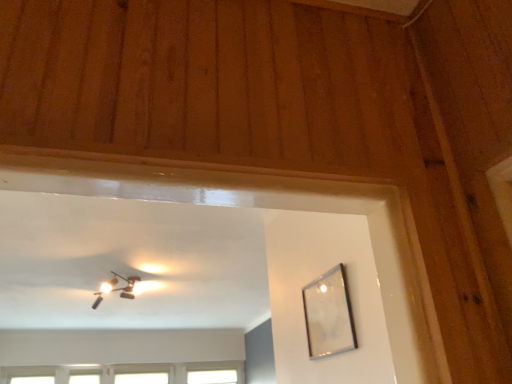
Find the location of a particular element. Image resolution: width=512 pixels, height=384 pixels. clear glass picture frame at upper right is located at coordinates (329, 314).

What do you see at coordinates (212, 377) in the screenshot? I see `white glass window at upper center, which ranks as the fourth window in left-to-right order` at bounding box center [212, 377].

Locate an element on the screen. The height and width of the screenshot is (384, 512). white glass window at upper center, which ranks as the fourth window in left-to-right order is located at coordinates (212, 377).

This screenshot has width=512, height=384. What do you see at coordinates (85, 376) in the screenshot?
I see `transparent glass window at lower left, the 2th window when ordered from left to right` at bounding box center [85, 376].

In order to face clear glass window at lower center, acting as the 3th window starting from the left, should I rotate leftwards or rightwards?

A 14.907 degree turn to the left will do.

At what (x,y) coordinates should I click in order to perform the action: click on clear glass picture frame at upper right. Please return your answer as a coordinate pair (x, y). This screenshot has width=512, height=384. Looking at the image, I should click on (329, 314).

Which is more to the right, matte black fixture at upper center or clear glass window at lower center, acting as the 3th window starting from the left?

From the viewer's perspective, matte black fixture at upper center appears more on the right side.

From the picture: Which point is more distant from viewer, (110,284) or (152,379)?

Point (152,379)

Between matte black fixture at upper center and clear glass window at lower center, acting as the 3th window starting from the left, which one has larger width?

Wider between the two is matte black fixture at upper center.

Which object is further away from the camera taking this photo, matte black fixture at upper center or clear glass window at lower center, acting as the 3th window starting from the left?

clear glass window at lower center, acting as the 3th window starting from the left, is further from the camera.

Is clear glass window at lower center, acting as the 3th window starting from the left, aimed at transparent glass window at lower left, acting as the first window starting from the left?

No.

What's the angular difference between clear glass window at lower center, the second window from the right, and transparent glass window at lower left, acting as the first window starting from the left,'s facing directions?

They differ by 0.0021 degrees in their facing directions.

Between clear glass window at lower center, acting as the 3th window starting from the left, and transparent glass window at lower left, acting as the first window starting from the left, which one has smaller size?

transparent glass window at lower left, acting as the first window starting from the left, is smaller.

Which is behind, point (121, 380) or point (39, 375)?

Point (121, 380)

Can you tell me how much matte black fixture at upper center and transparent glass window at lower left, acting as the first window starting from the left, differ in facing direction?

The angle between the facing direction of matte black fixture at upper center and the facing direction of transparent glass window at lower left, acting as the first window starting from the left, is 1.71 degrees.

From their relative heights in the image, would you say matte black fixture at upper center is taller or shorter than transparent glass window at lower left, acting as the first window starting from the left?

In the image, matte black fixture at upper center appears to be taller than transparent glass window at lower left, acting as the first window starting from the left.

Would you say matte black fixture at upper center contains transparent glass window at lower left, acting as the first window starting from the left?

No.

From a real-world perspective, is matte black fixture at upper center located beneath transparent glass window at lower left, acting as the first window starting from the left?

A: No, from a real-world perspective, matte black fixture at upper center is not below transparent glass window at lower left, acting as the first window starting from the left.

At what (x,y) coordinates should I click in order to perform the action: click on picture frame lying in front of the matte black fixture at upper center. Please return your answer as a coordinate pair (x, y). The image size is (512, 384). Looking at the image, I should click on (329, 314).

How far apart are clear glass picture frame at upper right and matte black fixture at upper center?

clear glass picture frame at upper right is 2.08 meters from matte black fixture at upper center.

From the image's perspective, is clear glass picture frame at upper right under matte black fixture at upper center?

No.

Can you see clear glass picture frame at upper right touching matte black fixture at upper center?

No, clear glass picture frame at upper right is not making contact with matte black fixture at upper center.

Between matte black fixture at upper center and transparent glass window at lower left, the 3th window when ordered from right to left, which one appears on the right side from the viewer's perspective?

Positioned to the right is matte black fixture at upper center.

Could you measure the distance between matte black fixture at upper center and transparent glass window at lower left, the 2th window when ordered from left to right?

matte black fixture at upper center is 7.02 feet from transparent glass window at lower left, the 2th window when ordered from left to right.

Is point (124, 293) in front of point (86, 372)?

Yes, it is.

Is matte black fixture at upper center inside the boundaries of transparent glass window at lower left, the 3th window when ordered from right to left, or outside?

matte black fixture at upper center is spatially situated outside transparent glass window at lower left, the 3th window when ordered from right to left.

At what (x,y) coordinates should I click in order to perform the action: click on lamp on the right of clear glass window at lower center, acting as the 3th window starting from the left. Please return your answer as a coordinate pair (x, y). The image size is (512, 384). Looking at the image, I should click on (116, 288).

Which of these two, clear glass window at lower center, acting as the 3th window starting from the left, or matte black fixture at upper center, stands taller?

Standing taller between the two is clear glass window at lower center, acting as the 3th window starting from the left.

Is point (146, 376) closer to camera compared to point (112, 291)?

That is False.

Does clear glass picture frame at upper right have a smaller size compared to transparent glass window at lower left, the 2th window when ordered from left to right?

Indeed, clear glass picture frame at upper right has a smaller size compared to transparent glass window at lower left, the 2th window when ordered from left to right.

Is clear glass picture frame at upper right beside transparent glass window at lower left, the 2th window when ordered from left to right?

clear glass picture frame at upper right and transparent glass window at lower left, the 2th window when ordered from left to right, are clearly separated.

Is clear glass picture frame at upper right facing away from transparent glass window at lower left, the 2th window when ordered from left to right?

clear glass picture frame at upper right does not have its back to transparent glass window at lower left, the 2th window when ordered from left to right.

From the image's perspective, is clear glass picture frame at upper right positioned above or below transparent glass window at lower left, the 3th window when ordered from right to left?

clear glass picture frame at upper right is situated higher than transparent glass window at lower left, the 3th window when ordered from right to left, in the image.

At what (x,y) coordinates should I click in order to perform the action: click on lamp above the clear glass window at lower center, the second window from the right (from the image's perspective). Please return your answer as a coordinate pair (x, y). Image resolution: width=512 pixels, height=384 pixels. Looking at the image, I should click on (116, 288).

The width and height of the screenshot is (512, 384). I want to click on window that is the 2nd one when counting leftward from the clear glass window at lower center, the second window from the right, so [28, 375].

Looking at the image, which one is located closer to clear glass picture frame at upper right, white glass window at upper center, which appears as the first window when viewed from the right, or transparent glass window at lower left, the 3th window when ordered from right to left?

white glass window at upper center, which appears as the first window when viewed from the right, is closer to clear glass picture frame at upper right.

In the scene shown: Based on their spatial positions, is clear glass window at lower center, the second window from the right, or white glass window at upper center, which ranks as the fourth window in left-to-right order, closer to clear glass picture frame at upper right?

white glass window at upper center, which ranks as the fourth window in left-to-right order, is closer to clear glass picture frame at upper right.

Looking at this image, estimate the real-world distances between objects in this image. Which object is closer to clear glass window at lower center, the second window from the right, matte black fixture at upper center or transparent glass window at lower left, acting as the first window starting from the left?

transparent glass window at lower left, acting as the first window starting from the left, is positioned closer to the anchor clear glass window at lower center, the second window from the right.

Looking at the image, which one is located closer to clear glass window at lower center, the second window from the right, transparent glass window at lower left, the 3th window when ordered from right to left, or transparent glass window at lower left, acting as the first window starting from the left?

transparent glass window at lower left, the 3th window when ordered from right to left, lies closer to clear glass window at lower center, the second window from the right, than the other object.

In the scene shown: Looking at the image, which one is located further to white glass window at upper center, which ranks as the fourth window in left-to-right order, transparent glass window at lower left, marked as the fourth window in a right-to-left arrangement, or matte black fixture at upper center?

matte black fixture at upper center.

Considering their positions, is white glass window at upper center, which appears as the first window when viewed from the right, positioned closer to transparent glass window at lower left, the 3th window when ordered from right to left, than clear glass picture frame at upper right?

white glass window at upper center, which appears as the first window when viewed from the right, is positioned closer to the anchor transparent glass window at lower left, the 3th window when ordered from right to left.

Which object lies further to the anchor point clear glass window at lower center, the second window from the right, transparent glass window at lower left, acting as the first window starting from the left, or white glass window at upper center, which appears as the first window when viewed from the right?

The object further to clear glass window at lower center, the second window from the right, is transparent glass window at lower left, acting as the first window starting from the left.

From the image, which object appears to be farther from matte black fixture at upper center, transparent glass window at lower left, marked as the fourth window in a right-to-left arrangement, or transparent glass window at lower left, the 2th window when ordered from left to right?

transparent glass window at lower left, the 2th window when ordered from left to right, is further to matte black fixture at upper center.

Where is `lamp between clear glass picture frame at upper right and clear glass window at lower center, the second window from the right, along the z-axis`? The image size is (512, 384). lamp between clear glass picture frame at upper right and clear glass window at lower center, the second window from the right, along the z-axis is located at coordinates (116, 288).

You are a GUI agent. You are given a task and a screenshot of the screen. Output one action in this format:
    pyautogui.click(x=<x>, y=<y>)
    Task: Click on the window located between transparent glass window at lower left, marked as the fourth window in a right-to-left arrangement, and clear glass window at lower center, acting as the 3th window starting from the left, in the left-right direction
    
    Given the screenshot: What is the action you would take?
    pyautogui.click(x=85, y=376)

At what (x,y) coordinates should I click in order to perform the action: click on lamp between clear glass picture frame at upper right and transparent glass window at lower left, acting as the first window starting from the left, in the front-back direction. Please return your answer as a coordinate pair (x, y). The image size is (512, 384). Looking at the image, I should click on (116, 288).

The image size is (512, 384). I want to click on window between matte black fixture at upper center and transparent glass window at lower left, the 2th window when ordered from left to right, from front to back, so click(28, 375).